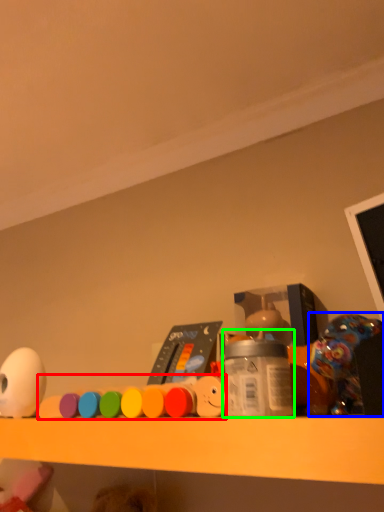
Question: Which is nearer to the toy (highlighted by a red box)? toy (highlighted by a blue box) or bottle (highlighted by a green box).

Choices:
 (A) toy
 (B) bottle

Answer: (B)